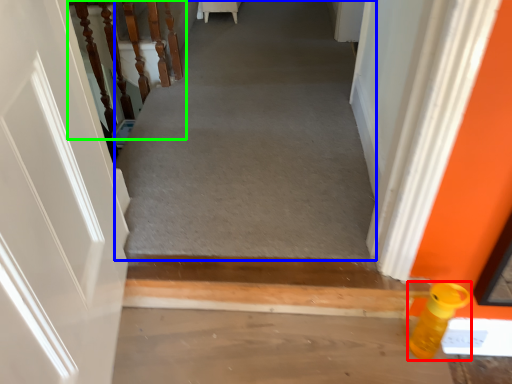
Question: Which object is positioned closest to bottle (highlighted by a red box)? Select from passage (highlighted by a blue box) and stairwell (highlighted by a green box).

Choices:
 (A) passage
 (B) stairwell

Answer: (A)